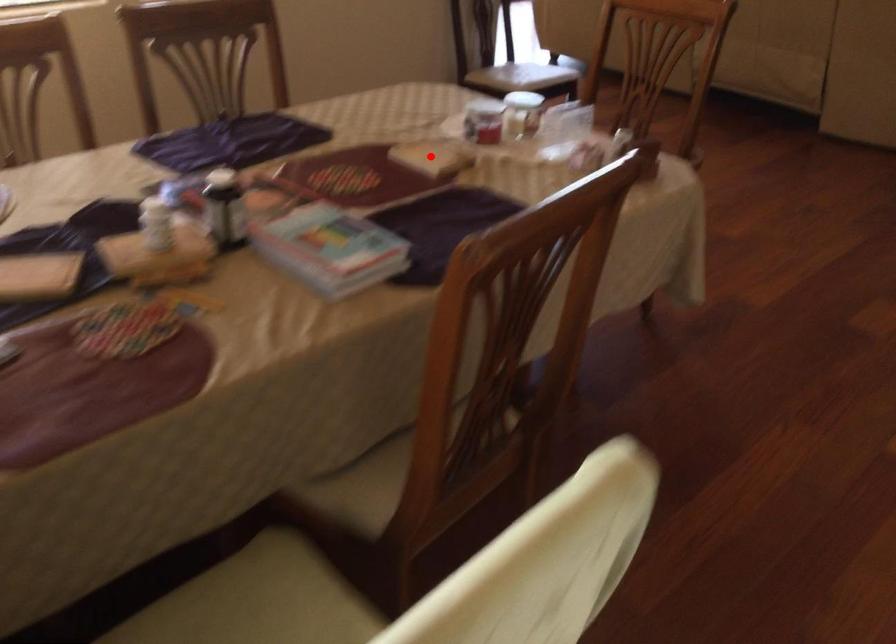
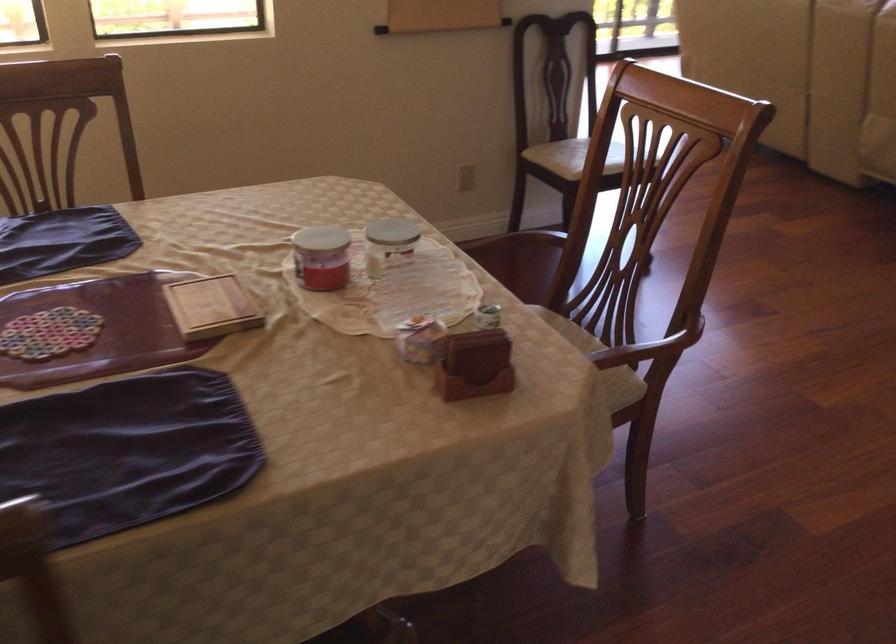
The point at the highlighted location is marked in the first image. Where is the corresponding point in the second image?

(211, 307)